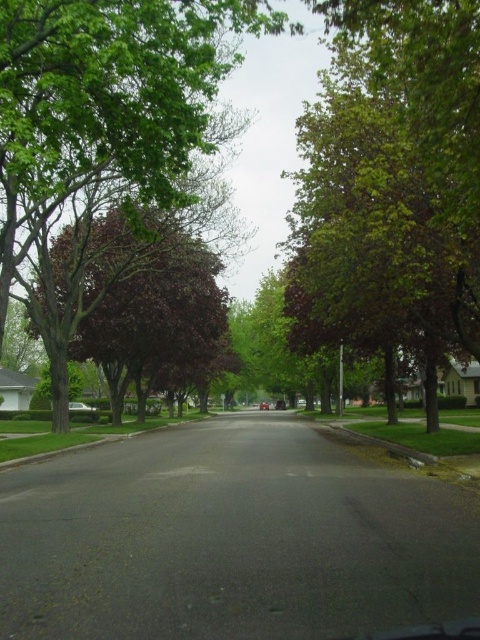
Question: Is the position of green leafy tree at center less distant than that of white glossy car at center?

Choices:
 (A) no
 (B) yes

Answer: (B)

Question: Among these points, which one is nearest to the camera?

Choices:
 (A) (75, 404)
 (B) (17, 252)

Answer: (B)

Question: Is white glossy car at center bigger than metallic red car at center?

Choices:
 (A) no
 (B) yes

Answer: (B)

Question: Which of these objects is positioned closest to the green leafy tree at center?

Choices:
 (A) metallic red car at center
 (B) white glossy car at center

Answer: (B)

Question: From the image, what is the correct spatial relationship of white glossy car at center in relation to metallic red car at center?

Choices:
 (A) left
 (B) right

Answer: (A)

Question: Which of the following is the farthest from the observer?

Choices:
 (A) metallic red car at center
 (B) green leafy tree at center

Answer: (A)